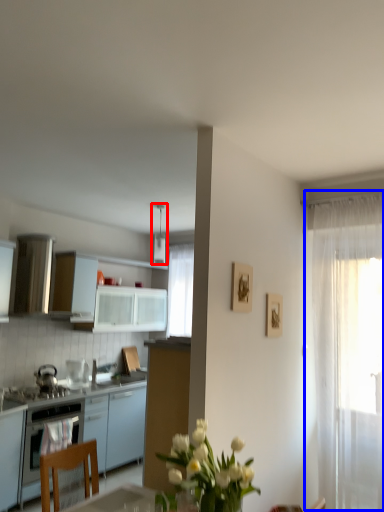
Question: Which of the following is the closest to the observer, appliance (highlighted by a red box) or curtain (highlighted by a blue box)?

Choices:
 (A) appliance
 (B) curtain

Answer: (B)